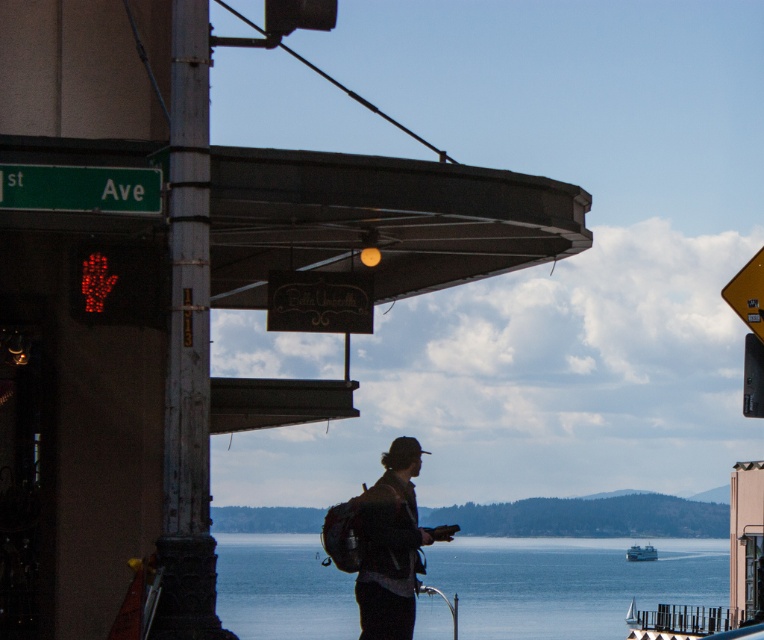
You are a delivery person who needs to carry both the dark gray backpack at center and the metallic rectangular at right. Which object should you pick up first to ensure you can carry both comfortably?

The dark gray backpack at center is thinner than the metallic rectangular at right, so you should pick up the metallic rectangular at right first to ensure it fits properly when carrying both.

You are a pedestrian at the intersection. You see the dark gray backpack at center and the yellow reflective plastic traffic sign at upper right. Which object is positioned higher in the image?

The yellow reflective plastic traffic sign at upper right is positioned higher in the image than the dark gray backpack at center.